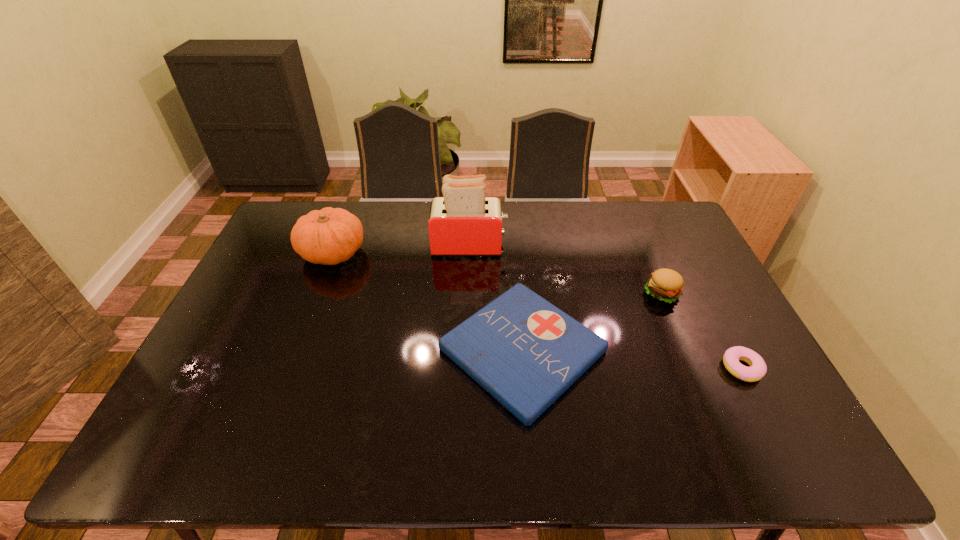
I want to click on vacant space situated on the back of the first-aid kit, so click(513, 242).

Where is `free space located 0.310m on the left of the doughnut`? free space located 0.310m on the left of the doughnut is located at coordinates (605, 368).

In order to click on toaster at the far edge in this screenshot , I will do `click(463, 222)`.

Locate an element on the screen. pumpkin that is at the far edge is located at coordinates (329, 236).

At what (x,y) coordinates should I click in order to perform the action: click on object that is at the left edge. Please return your answer as a coordinate pair (x, y). This screenshot has width=960, height=540. Looking at the image, I should click on (329, 236).

At what (x,y) coordinates should I click in order to perform the action: click on hamburger that is positioned at the right edge. Please return your answer as a coordinate pair (x, y). Looking at the image, I should click on (666, 285).

Image resolution: width=960 pixels, height=540 pixels. Find the location of `doughnut located in the right edge section of the desktop`. doughnut located in the right edge section of the desktop is located at coordinates (757, 370).

This screenshot has height=540, width=960. Identify the location of object located at the far left corner. (329, 236).

This screenshot has width=960, height=540. I want to click on free space at the far edge of the desktop, so click(x=582, y=220).

This screenshot has height=540, width=960. I want to click on free location at the near edge, so click(622, 461).